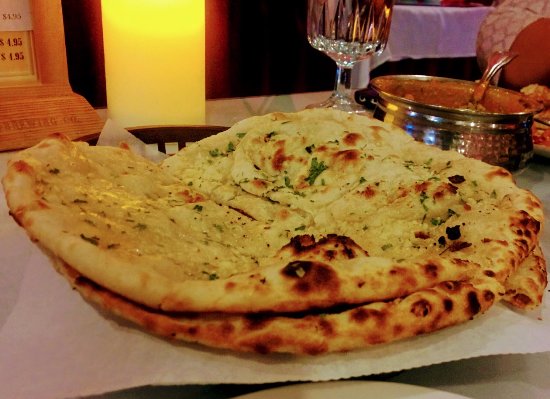
Where is `serving utensil`? serving utensil is located at coordinates (494, 61).